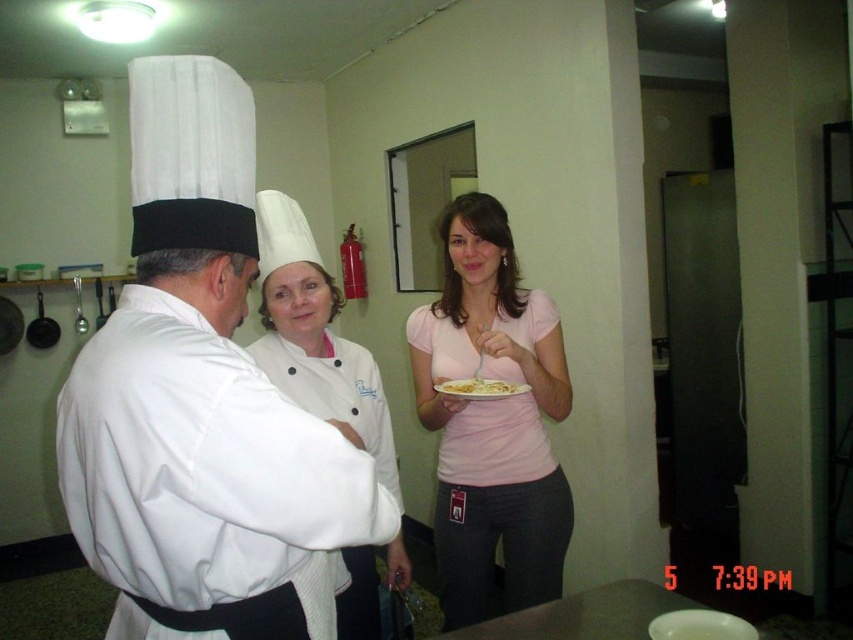
Is point (218, 545) farther from viewer compared to point (474, 390)?

No, (218, 545) is closer to viewer.

Is white matte chef hat at left to the left of yellow matte pasta at center from the viewer's perspective?

Correct, you'll find white matte chef hat at left to the left of yellow matte pasta at center.

Describe the element at coordinates (202, 403) in the screenshot. I see `white matte chef hat at left` at that location.

At what (x,y) coordinates should I click in order to perform the action: click on white matte chef hat at left. Please return your answer as a coordinate pair (x, y). The width and height of the screenshot is (853, 640). Looking at the image, I should click on (202, 403).

Who is more distant from viewer, (125, 317) or (451, 612)?

The point (451, 612) is more distant.

Locate an element on the screen. Image resolution: width=853 pixels, height=640 pixels. white matte chef hat at left is located at coordinates (202, 403).

Consider the image. Does white matte chef hat at center lie in front of yellow matte pasta at center?

Yes, white matte chef hat at center is in front of yellow matte pasta at center.

Looking at this image, does white matte chef hat at center appear on the left side of yellow matte pasta at center?

Indeed, white matte chef hat at center is positioned on the left side of yellow matte pasta at center.

Which is behind, point (368, 406) or point (485, 385)?

Positioned behind is point (485, 385).

Locate an element on the screen. This screenshot has height=640, width=853. white matte chef hat at center is located at coordinates (314, 336).